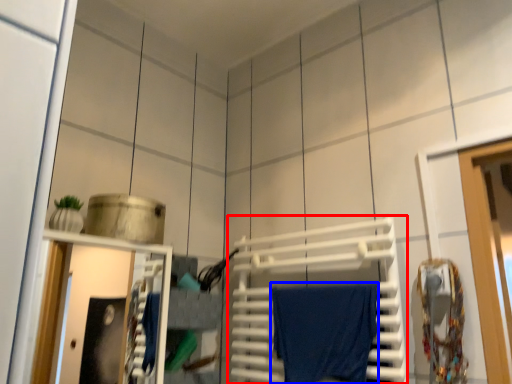
Question: Which object is further to the camera taking this photo, wide (highlighted by a red box) or bath towel (highlighted by a blue box)?

Choices:
 (A) wide
 (B) bath towel

Answer: (B)